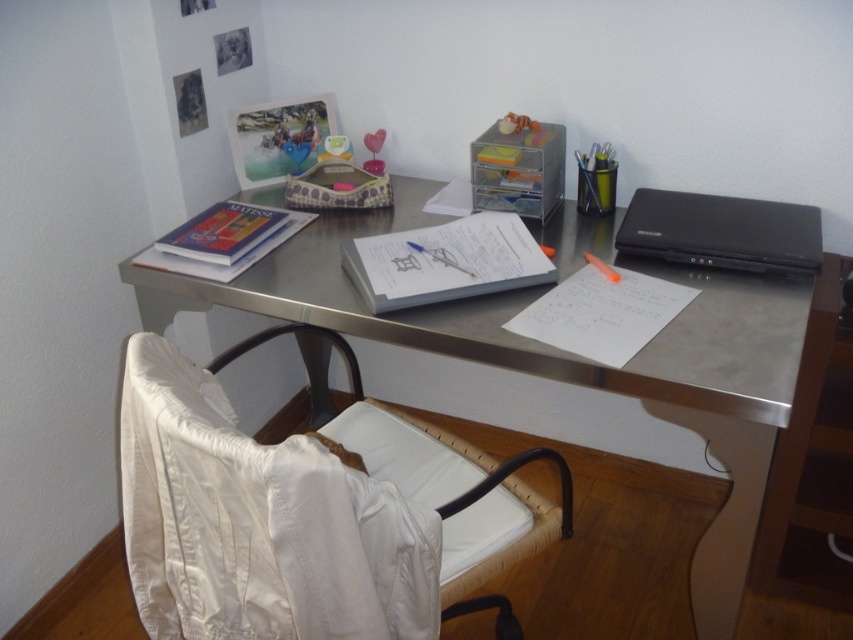
You are trying to place a new notebook on the desk. The metallic gray desk at center has a specific layout. Where should you place the new notebook in relation to the white paper at center to maintain the current arrangement?

The metallic gray desk at center is positioned on the right side of white paper at center, so placing the new notebook to the left of the white paper at center would maintain the current arrangement.

You are trying to place a new item on the desk in the home office scene. The desk has a metallic surface and a curved design. You have a white paper at center. Where exactly should you place it to avoid overlapping with existing items?

The white paper at center is already placed at point (445, 260), so you should avoid placing the new item there to prevent overlapping.

You are standing in front of the home office desk. There is a metallic gray desk at center. Where is the point located at coordinates [614,381] in relation to the metallic gray desk at center?

The point located at coordinates [614,381] corresponds to the metallic gray desk at center.